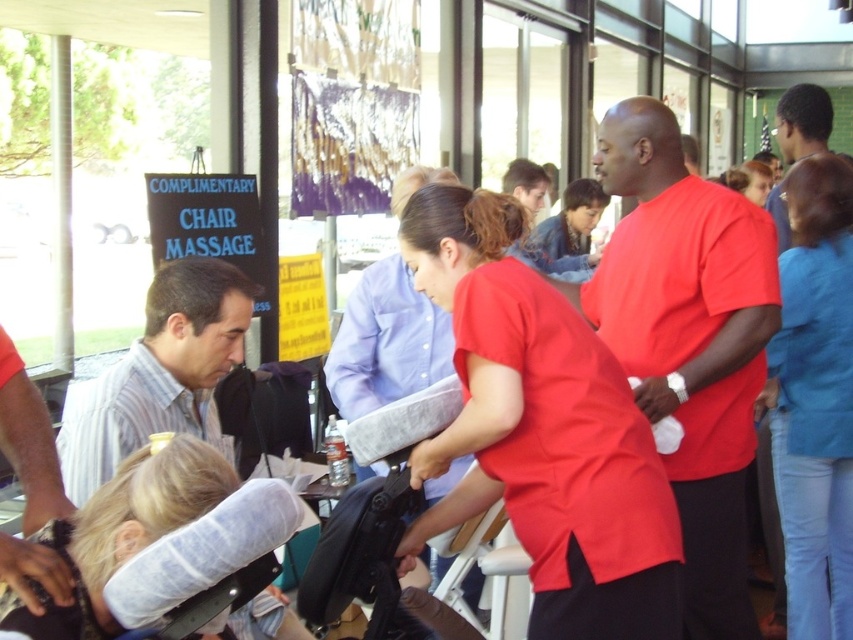
You are a photographer positioned in front of the matte red shirt at center and the blonde hair at center. Which subject should you focus on first to ensure both are in the frame without moving the camera?

You should focus on the matte red shirt at center first because it is closer to you than the blonde hair at center, ensuring it stays in the frame while adjusting for depth.

You are a photographer at the event and want to capture both the matte red shirt at center and the blue denim jeans at right in a single frame. Which object should you focus on first to ensure both are in the frame?

The matte red shirt at center is smaller than the blue denim jeans at right, so you should focus on the blue denim jeans at right first to ensure both are in the frame.